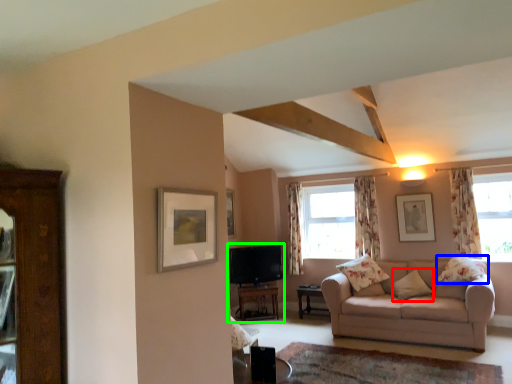
Question: Which is nearer to the pillow (highlighted by a red box)? pillow (highlighted by a blue box) or entertainment center (highlighted by a green box).

Choices:
 (A) pillow
 (B) entertainment center

Answer: (A)